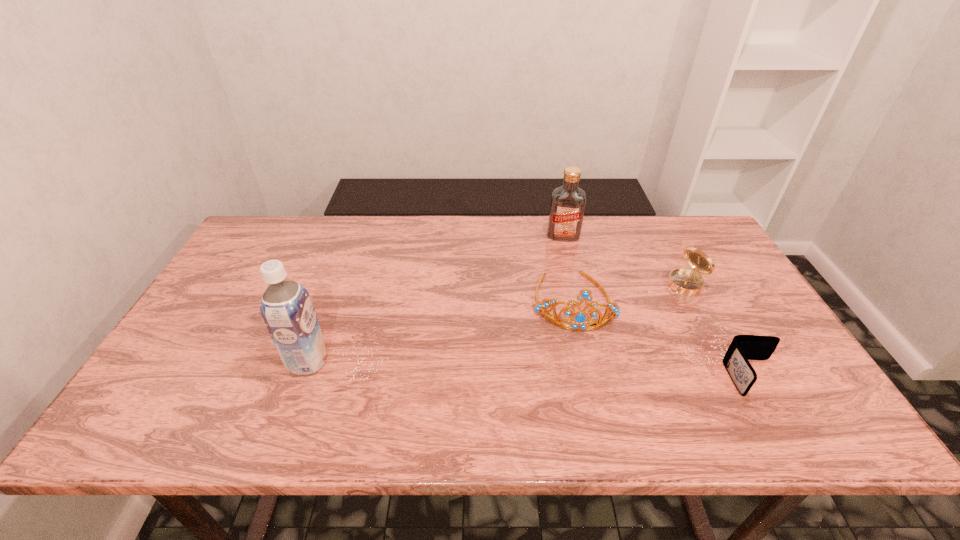
Locate an element on the screen. This screenshot has height=540, width=960. soya milk that is at the near edge is located at coordinates (286, 307).

Locate an element on the screen. The image size is (960, 540). wallet present at the near edge is located at coordinates (743, 347).

Where is `wallet present at the right edge`? wallet present at the right edge is located at coordinates (743, 347).

At what (x,y) coordinates should I click in order to perform the action: click on compass that is at the right edge. Please return your answer as a coordinate pair (x, y). Looking at the image, I should click on (687, 282).

The width and height of the screenshot is (960, 540). I want to click on object that is at the near right corner, so click(743, 347).

Identify the location of vacant space at the far edge of the desktop. This screenshot has height=540, width=960. (512, 226).

This screenshot has width=960, height=540. I want to click on free space at the near edge of the desktop, so click(321, 386).

Locate an element on the screen. free space at the left edge of the desktop is located at coordinates (207, 323).

At what (x,y) coordinates should I click in order to perform the action: click on free space at the right edge of the desktop. Please return your answer as a coordinate pair (x, y). The height and width of the screenshot is (540, 960). Looking at the image, I should click on (716, 278).

At what (x,y) coordinates should I click in order to perform the action: click on vacant space at the far left corner of the desktop. Please return your answer as a coordinate pair (x, y). This screenshot has width=960, height=540. Looking at the image, I should click on click(251, 233).